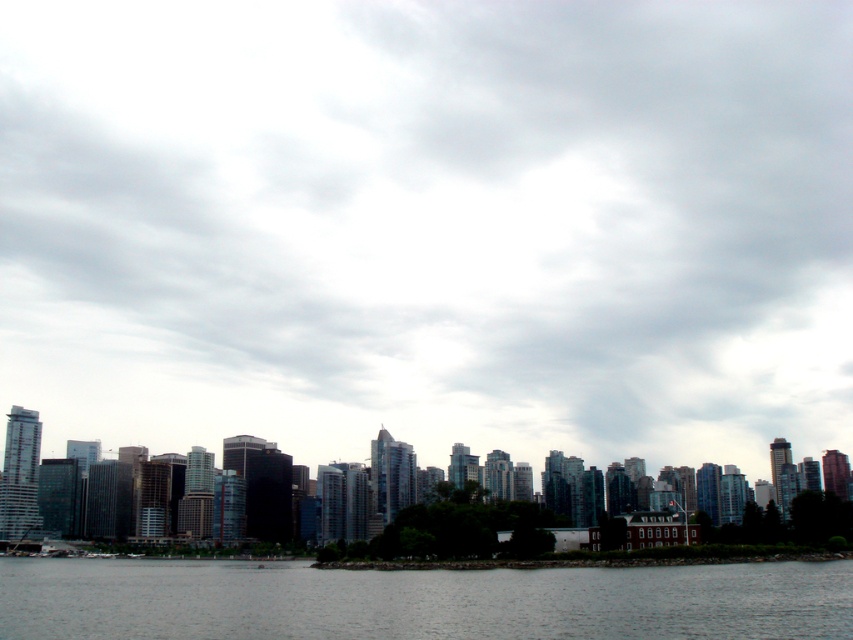
You are a photographer planning to capture the entire scene in one shot. Given that the dark gray water at lower center and the glassy skyscrapers at center are both in your frame, which object occupies more horizontal space in the image?

The glassy skyscrapers at center occupy more horizontal space in the image since the dark gray water at lower center has a lesser width compared to them.

You are an urban planner analyzing the city layout. You observe the dark gray water at lower center and the glassy skyscrapers at center. Which of these two elements takes up more visual space in the scene?

The glassy skyscrapers at center occupy more visual space than the dark gray water at lower center, as stated in the description.

You are a photographer planning to capture the city skyline from a boat in the bay. You notice the cloudy sky at upper center and the glassy skyscrapers at center. Which of these two elements will appear taller in your photo?

The cloudy sky at upper center is much taller than the glassy skyscrapers at center, so it will appear taller in the photo.